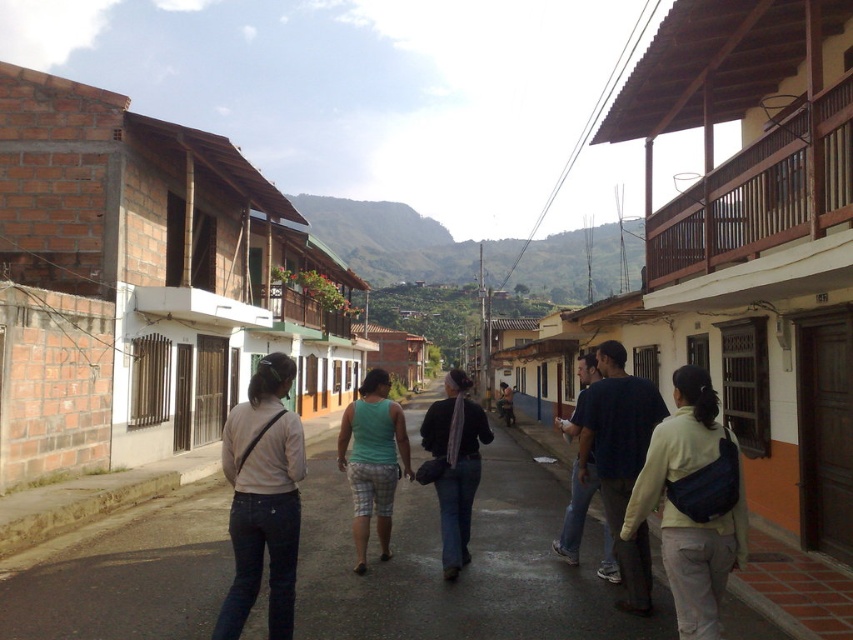
Question: Does denim pants at center appear on the left side of light yellow fabric jacket at lower right?

Choices:
 (A) yes
 (B) no

Answer: (A)

Question: Can you confirm if light yellow fabric jacket at lower right is positioned to the left of green fabric tank top at center?

Choices:
 (A) no
 (B) yes

Answer: (B)

Question: Which is nearer to the light beige fabric shirt at center?

Choices:
 (A) green fabric tank top at center
 (B) dark blue jeans at center
 (C) green fabric shorts at center
 (D) denim pants at center

Answer: (C)

Question: Can you confirm if dark blue jeans at center is positioned to the right of green fabric tank top at center?

Choices:
 (A) yes
 (B) no

Answer: (B)

Question: Estimate the real-world distances between objects in this image. Which object is closer to the blue jeans at center?

Choices:
 (A) denim pants at center
 (B) dark blue shirt at center
 (C) light beige fabric shirt at center

Answer: (B)

Question: Which of the following is the farthest from the observer?

Choices:
 (A) light yellow fabric jacket at lower right
 (B) green fabric tank top at center
 (C) dark blue shirt at center

Answer: (B)